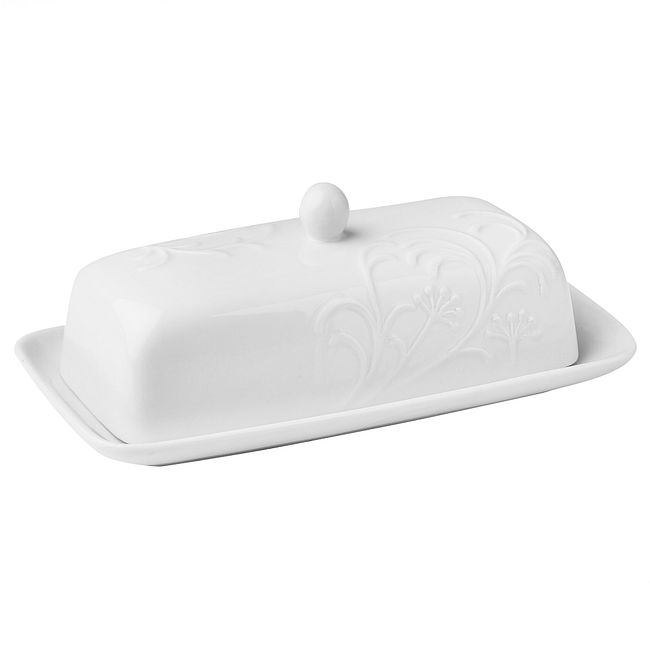
Locate an element on the screen. This screenshot has width=650, height=650. rounded corners of butter dish is located at coordinates (150, 327), (81, 268), (472, 196), (547, 253).